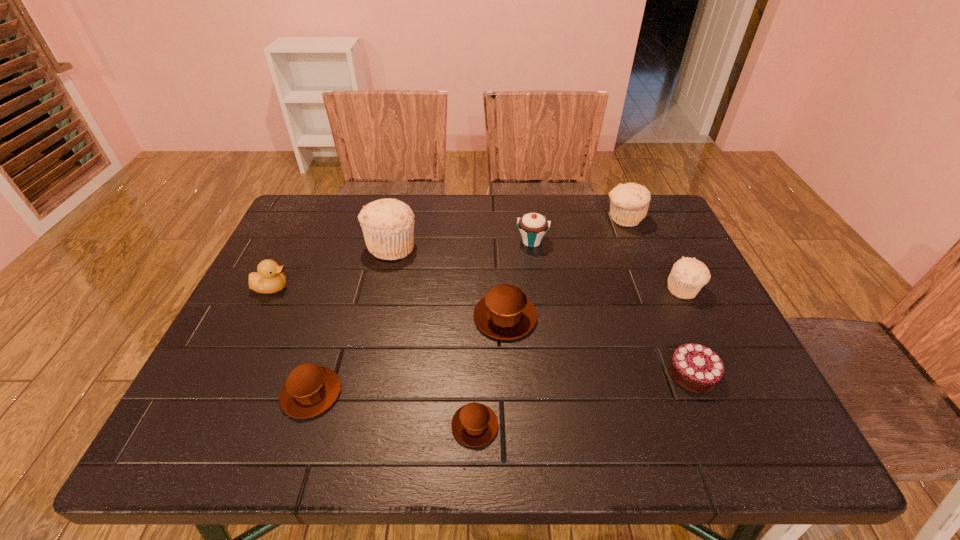
This screenshot has height=540, width=960. In order to click on chocolate cake in this screenshot , I will do `click(696, 368)`.

This screenshot has width=960, height=540. In order to click on the smallest brown muffin in this screenshot , I will do `click(474, 424)`.

The image size is (960, 540). I want to click on the shortest object, so click(x=474, y=424).

Find the location of a particular element. The height and width of the screenshot is (540, 960). free space located 0.290m on the front of the biggest beige muffin is located at coordinates (367, 350).

Where is `free region located on the front of the second tallest muffin`? free region located on the front of the second tallest muffin is located at coordinates (670, 330).

You are a GUI agent. You are given a task and a screenshot of the screen. Output one action in this format:
    pyautogui.click(x=<x>, y=<y>)
    Task: Click on the vacant space located on the left of the cupcake
    The image size is (960, 540).
    Given the screenshot: What is the action you would take?
    pyautogui.click(x=402, y=241)

Locate an element on the screen. vacant space located facing forward on the duckling is located at coordinates (378, 287).

The width and height of the screenshot is (960, 540). What are the coordinates of `vacant position located on the left of the nearest beige muffin` in the screenshot? It's located at (516, 289).

Locate an element on the screen. free location located 0.200m on the front of the biggest brown muffin is located at coordinates (511, 424).

This screenshot has height=540, width=960. I want to click on vacant space located on the back of the fifth tallest muffin, so click(340, 303).